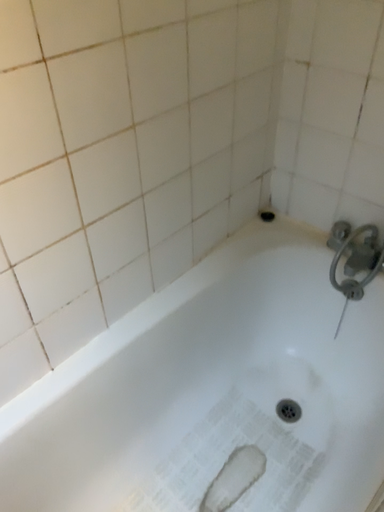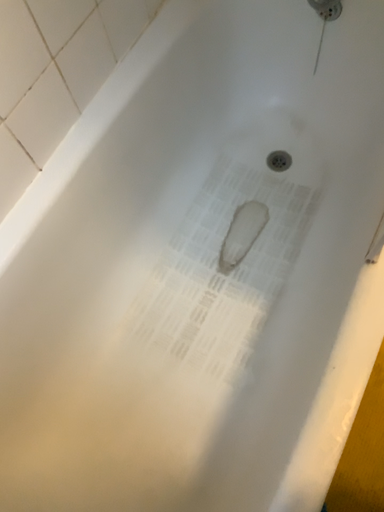
Question: How did the camera likely rotate when shooting the video?

Choices:
 (A) rotated right
 (B) rotated left

Answer: (A)